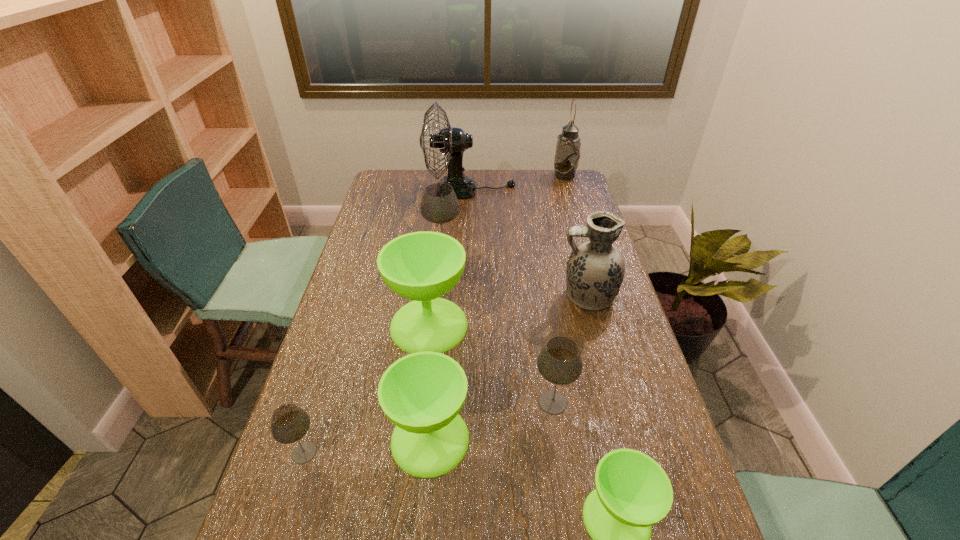
The width and height of the screenshot is (960, 540). What are the coordinates of `vacant position at the far left corner of the desktop` in the screenshot? It's located at (402, 191).

Locate an element on the screen. The height and width of the screenshot is (540, 960). free space at the far right corner of the desktop is located at coordinates (574, 190).

Where is `free point between the third farthest object and the rightmost gray wineglass`? The width and height of the screenshot is (960, 540). free point between the third farthest object and the rightmost gray wineglass is located at coordinates (498, 328).

You are a GUI agent. You are given a task and a screenshot of the screen. Output one action in this format:
    pyautogui.click(x=<x>, y=<y>)
    Task: Click on the vacant area that lies between the second smallest green wineglass and the oil lamp
    The image size is (960, 540).
    Given the screenshot: What is the action you would take?
    pyautogui.click(x=497, y=307)

In order to click on empty location between the farthest green wineglass and the rightmost gray wineglass in this screenshot , I will do coord(491,363).

The image size is (960, 540). In order to click on free space between the second biggest gray wineglass and the biggest green wineglass in this screenshot , I will do `click(491, 363)`.

This screenshot has width=960, height=540. I want to click on the fourth closest object to the second biggest gray wineglass, so click(595, 270).

Find the location of a particular element. This screenshot has height=540, width=960. object that is the third closest to the leftmost gray wineglass is located at coordinates (559, 362).

I want to click on wineglass that stands as the fourth closest to the rightmost gray wineglass, so click(289, 423).

Select which wineglass appears as the third closest to the nearest gray wineglass. Please provide its 2D coordinates. Your answer should be formatted as a tuple, i.e. [(x, y)], where the tuple contains the x and y coordinates of a point satisfying the conditions above.

[(559, 362)]